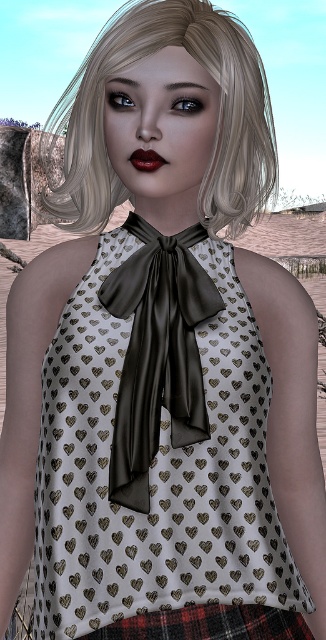
Question: Does white satin dress at center appear over matte black lips at center?

Choices:
 (A) no
 (B) yes

Answer: (A)

Question: Can you confirm if red plaid skirt at lower center is positioned to the right of matte black lips at center?

Choices:
 (A) yes
 (B) no

Answer: (A)

Question: Which point appears closest to the camera in this image?

Choices:
 (A) (180, 548)
 (B) (133, 166)

Answer: (A)

Question: Estimate the real-world distances between objects in this image. Which object is closer to the white satin dress at center?

Choices:
 (A) red plaid skirt at lower center
 (B) blonde silky hair at upper center
 (C) satin black bow tie at center
 (D) matte black lips at center

Answer: (C)

Question: Is blonde silky hair at upper center in front of satin black bow tie at center?

Choices:
 (A) yes
 (B) no

Answer: (B)

Question: Which point is closer to the camera taking this photo?

Choices:
 (A) (147, 170)
 (B) (227, 611)
 (C) (73, 106)
 (D) (109, 488)

Answer: (D)